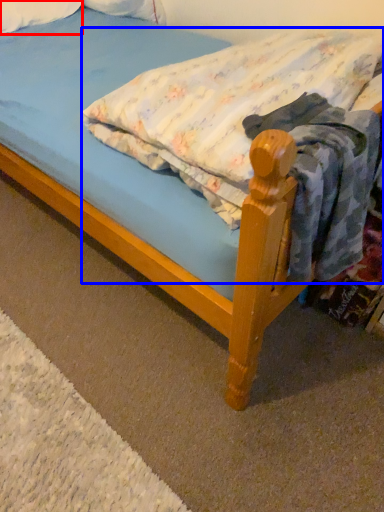
Question: Which object appears closest to the camera in this image, pillow (highlighted by a red box) or mattress (highlighted by a blue box)?

Choices:
 (A) pillow
 (B) mattress

Answer: (B)